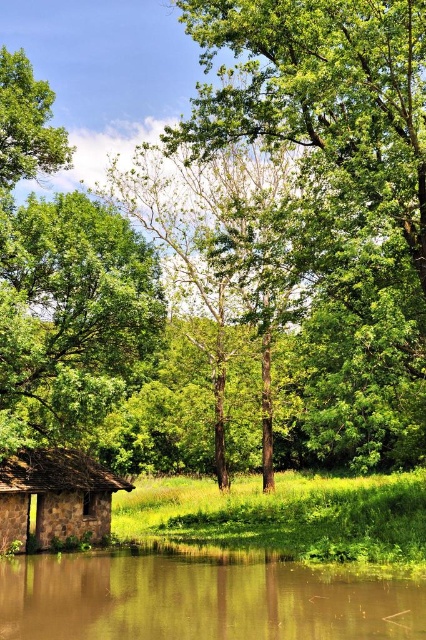
In the scene shown: Is green leafy tree at center shorter than brown murky water at lower center?

Incorrect, green leafy tree at center's height does not fall short of brown murky water at lower center's.

Does point (270, 61) come farther from viewer compared to point (71, 600)?

Yes, point (270, 61) is farther from viewer.

Find the location of a particular element. green leafy tree at center is located at coordinates (331, 134).

This screenshot has width=426, height=640. What are the coordinates of `brown murky water at lower center` in the screenshot? It's located at (203, 596).

Which is above, brown murky water at lower center or stone hut at lower left?

stone hut at lower left

Does point (244, 580) come closer to viewer compared to point (37, 518)?

Yes, point (244, 580) is in front of point (37, 518).

This screenshot has height=640, width=426. I want to click on brown murky water at lower center, so click(203, 596).

Between green leafy tree at center and stone hut at lower left, which one has more height?

With more height is green leafy tree at center.

Is point (377, 305) closer to camera compared to point (72, 509)?

Yes.

I want to click on green leafy tree at center, so click(x=331, y=134).

Identify the location of green leafy tree at center. The image size is (426, 640). (331, 134).